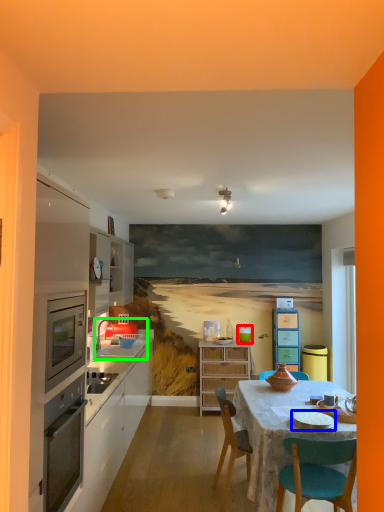
Question: Considering the real-world distances, which object is farthest from teal (highlighted by a red box)? tableware (highlighted by a blue box) or sink (highlighted by a green box)?

Choices:
 (A) tableware
 (B) sink

Answer: (A)